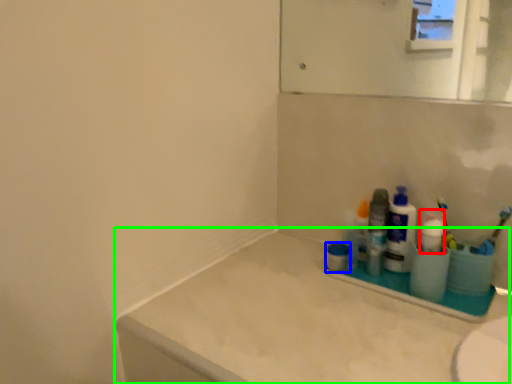
Question: Which is nearer to the cleaning product (highlighted by a red box)? mouthwash (highlighted by a blue box) or counter top (highlighted by a green box).

Choices:
 (A) mouthwash
 (B) counter top

Answer: (A)